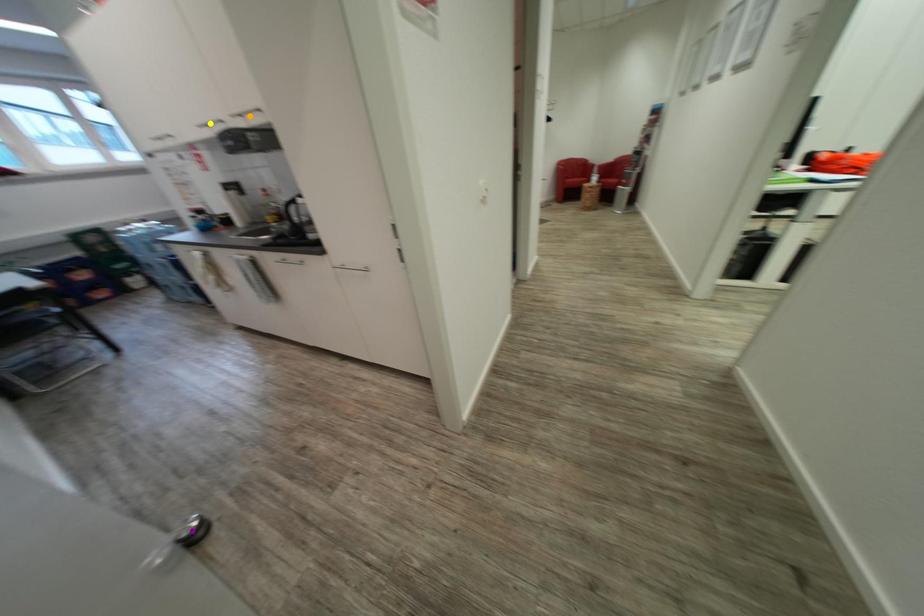
Order these from farthest to nearest:
A) yellow point
B) orange point
C) purple point

yellow point
orange point
purple point